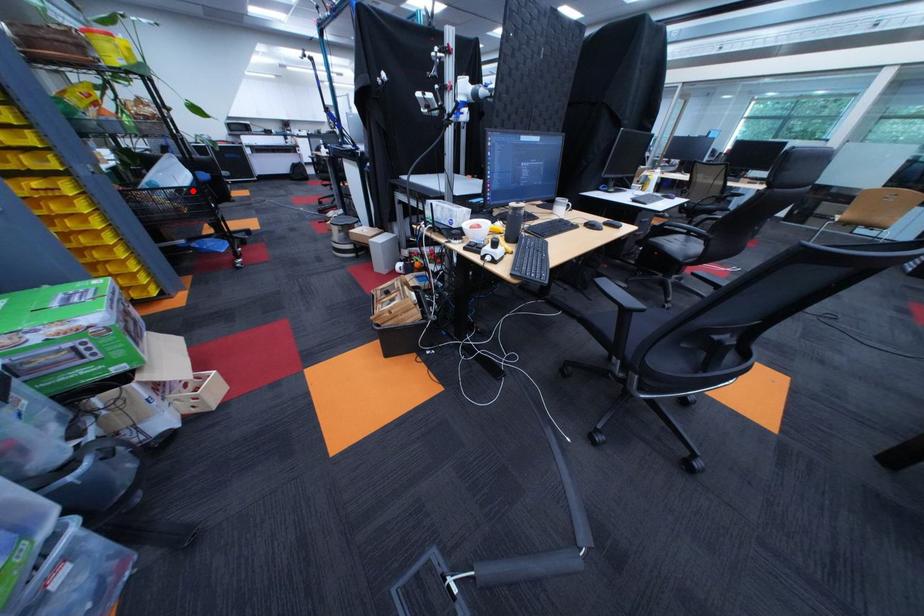
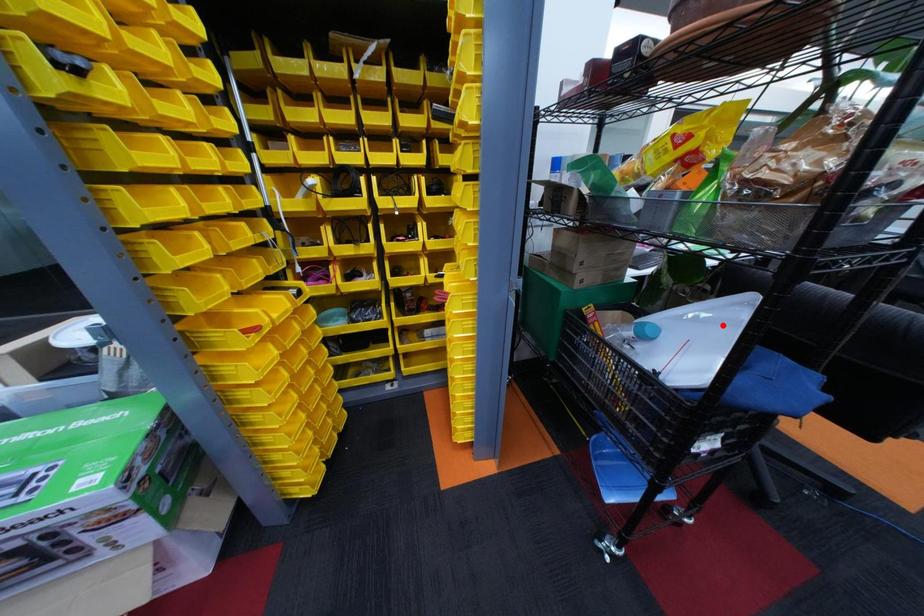
I am providing you with two images of the same scene from different viewpoints. A red point is marked on the first image and another point is marked on the second image. Is the marked point in image1 the same physical position as the marked point in image2?

No